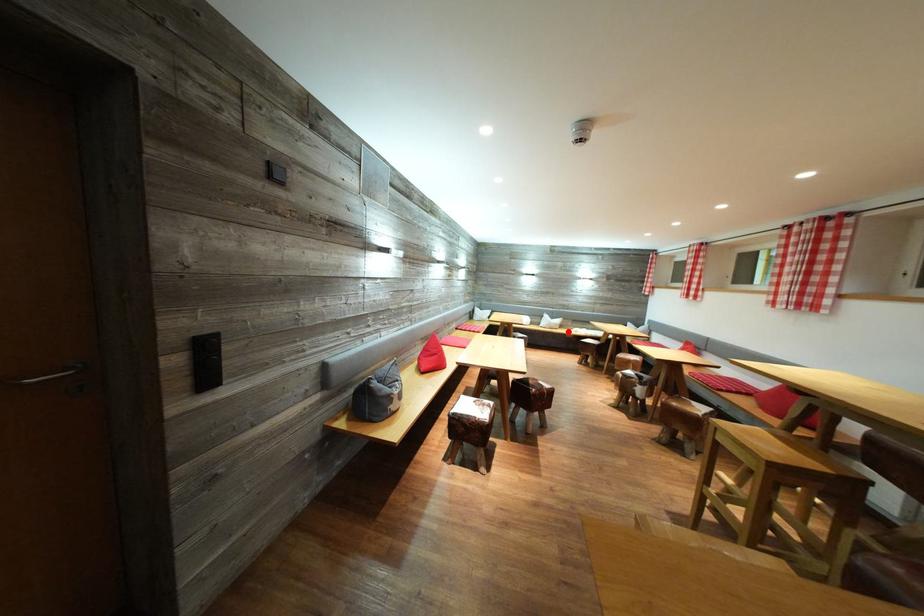
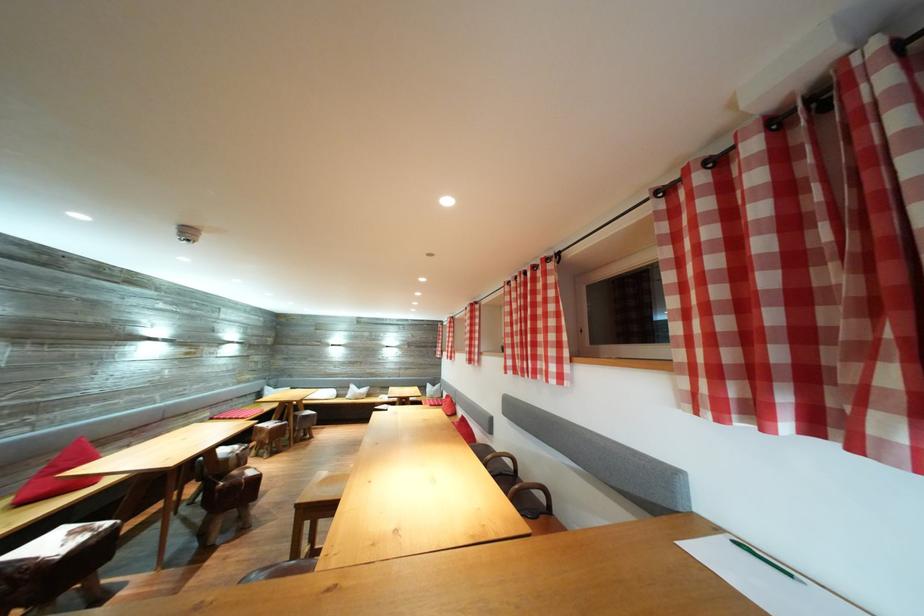
The point at the highlighted location is marked in the first image. Where is the corresponding point in the second image?

(375, 400)